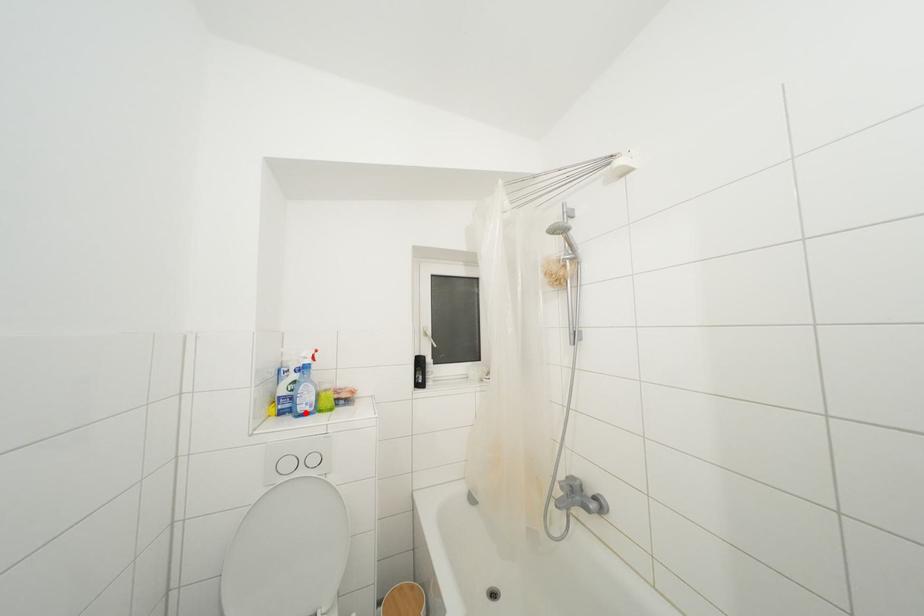
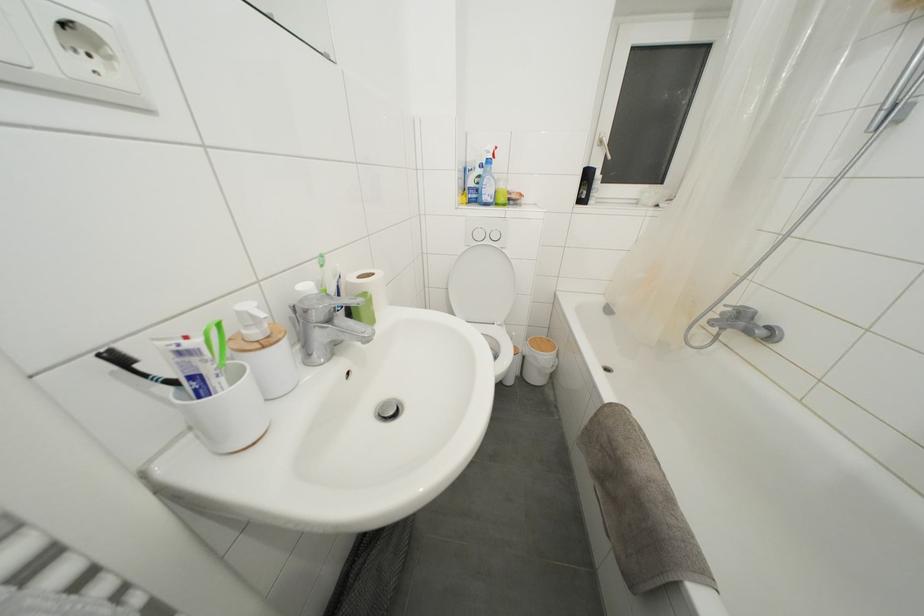
Locate, in the second image, the point that corresponds to the highlighted location in the first image.

(490, 203)